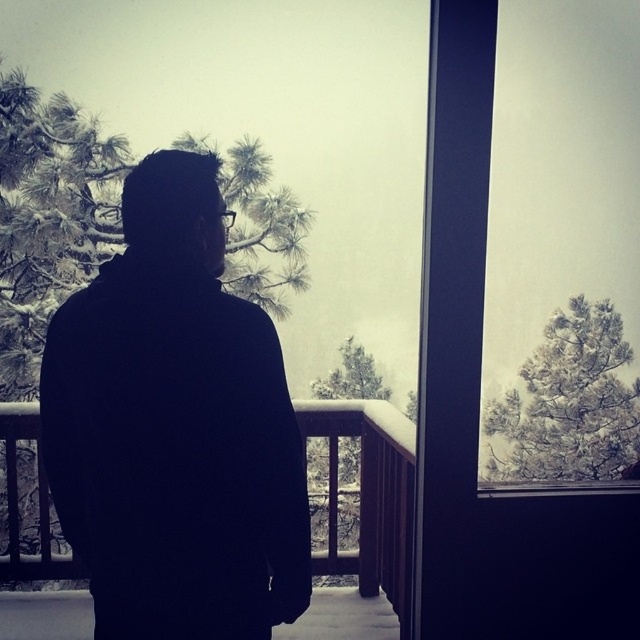
Is snow-covered pine tree at upper center further to camera compared to wooden at left?

Yes.

Can you confirm if snow-covered pine tree at upper center is shorter than wooden at left?

No, snow-covered pine tree at upper center is not shorter than wooden at left.

The width and height of the screenshot is (640, 640). Find the location of `snow-covered pine tree at upper center`. snow-covered pine tree at upper center is located at coordinates (568, 404).

Can you confirm if black matte jacket at center is bigger than snow-covered pine tree at upper center?

No, black matte jacket at center is not bigger than snow-covered pine tree at upper center.

Which is below, black matte jacket at center or snow-covered pine tree at upper center?

snow-covered pine tree at upper center

Locate an element on the screen. The image size is (640, 640). black matte jacket at center is located at coordinates (176, 428).

Is black matte jacket at center below wooden at left?

Incorrect, black matte jacket at center is not positioned below wooden at left.

Is black matte jacket at center thinner than wooden at left?

Incorrect, black matte jacket at center's width is not less than wooden at left's.

Where is `black matte jacket at center`? Image resolution: width=640 pixels, height=640 pixels. black matte jacket at center is located at coordinates (176, 428).